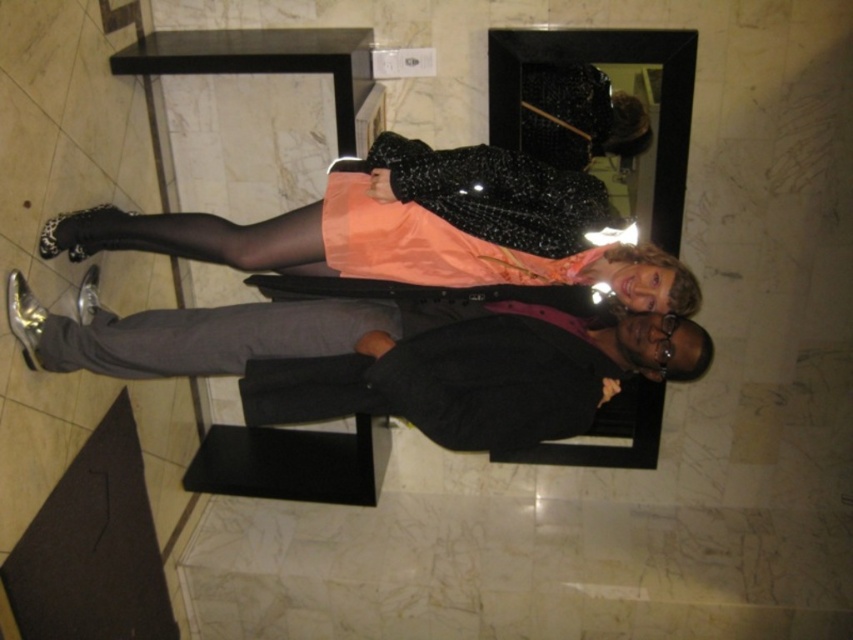
Question: Estimate the real-world distances between objects in this image. Which object is farther from the matte black suit at center?

Choices:
 (A) gray smooth pants at lower center
 (B) matte orange dress at center

Answer: (B)

Question: Does matte black suit at center appear under matte orange dress at center?

Choices:
 (A) no
 (B) yes

Answer: (B)

Question: Considering the relative positions of matte black suit at center and matte orange dress at center in the image provided, where is matte black suit at center located with respect to matte orange dress at center?

Choices:
 (A) below
 (B) above

Answer: (A)

Question: Based on their relative distances, which object is farther from the matte black suit at center?

Choices:
 (A) matte orange dress at center
 (B) gray smooth pants at lower center

Answer: (A)

Question: Which is nearer to the gray smooth pants at lower center?

Choices:
 (A) matte orange dress at center
 (B) matte black suit at center

Answer: (B)

Question: Is matte orange dress at center to the left of gray smooth pants at lower center from the viewer's perspective?

Choices:
 (A) no
 (B) yes

Answer: (A)